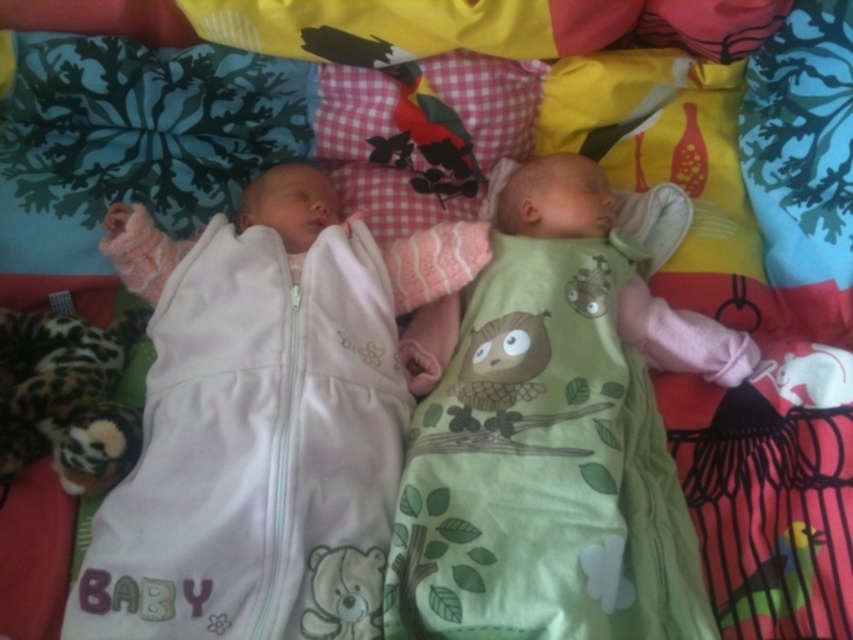
In the scene shown: Is green soft baby at center wider than white soft baby sleeping bag at left?

Yes, green soft baby at center is wider than white soft baby sleeping bag at left.

Between green soft baby at center and white soft baby sleeping bag at left, which one has more height?

green soft baby at center is taller.

Which is behind, point (579, 372) or point (268, 548)?

The point (579, 372) is more distant.

The width and height of the screenshot is (853, 640). Identify the location of green soft baby at center. (556, 428).